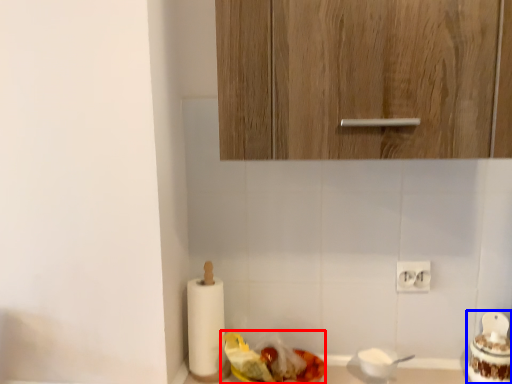
Question: Which object appears closest to the camera in this image, food (highlighted by a red box) or food (highlighted by a blue box)?

Choices:
 (A) food
 (B) food

Answer: (A)